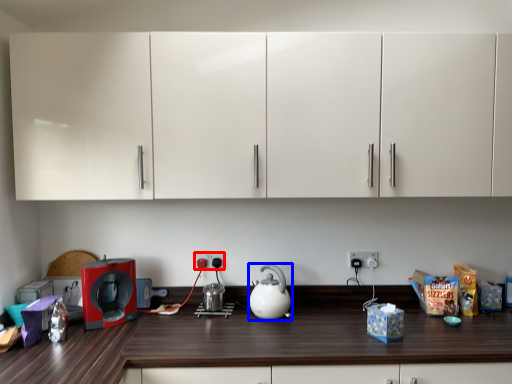
Question: Which object appears farthest to the camera in this image, electric outlet (highlighted by a red box) or kitchen appliance (highlighted by a blue box)?

Choices:
 (A) electric outlet
 (B) kitchen appliance

Answer: (A)